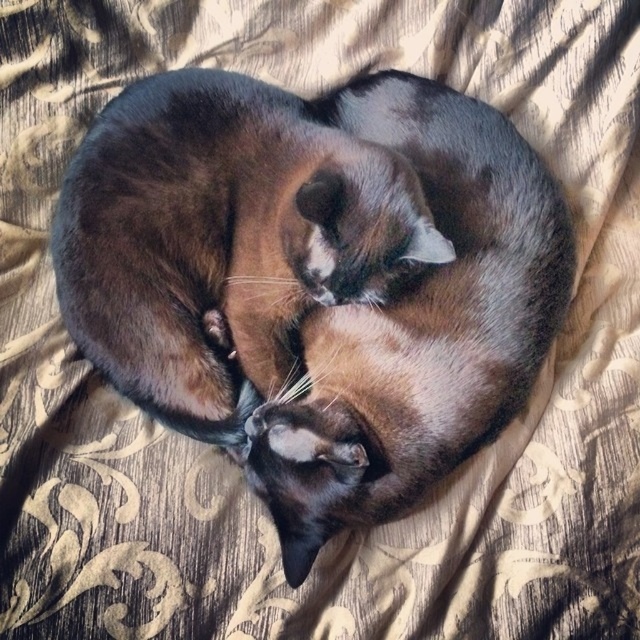
You are a photographer trying to capture the two cats in the heart shape. Since you want to ensure the shiny black cat at center and the shiny brown cat at center are both visible in the frame, which cat should you adjust to be higher in the composition?

The shiny black cat at center has a lesser height compared to the shiny brown cat at center, so you should adjust the shiny black cat at center to be higher to ensure both are visible in the frame.

You are a photographer trying to capture the two cats forming a heart shape. You want to ensure both cats fit entirely within the frame. Given that your camera has a maximum frame width of 1 meter, and the distance between the leftmost point of the shiny black cat at center and the rightmost point of the shiny brown cat at center is 0.8 meters, will both cats fit within the frame?

The distance between the leftmost point of the shiny black cat at center and the rightmost point of the shiny brown cat at center is 0.8 meters, which is less than the camera frame width of 1 meter. Therefore, both cats will fit within the frame.